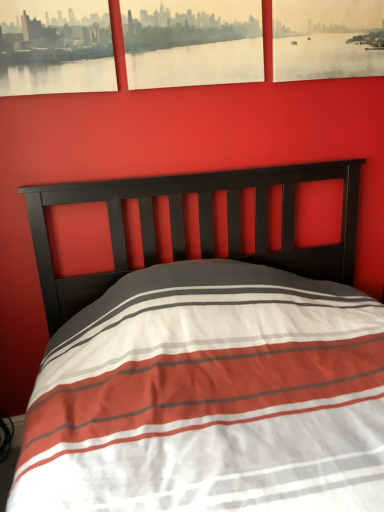
Find the location of a particular element. The image size is (384, 512). matte black picture frame at upper left, the third picture frame in the right-to-left sequence is located at coordinates (55, 47).

Is matte black picture frame at upper left, the third picture frame in the right-to-left sequence, oriented towards matte paper picture frame at upper right, which ranks as the first picture frame in right-to-left order?

No, matte black picture frame at upper left, the third picture frame in the right-to-left sequence, does not turn towards matte paper picture frame at upper right, which ranks as the first picture frame in right-to-left order.

From the image's perspective, is matte black picture frame at upper left, arranged as the first picture frame when viewed from the left, over matte paper picture frame at upper right, which is the 3th picture frame in left-to-right order?

No, from the image's perspective, matte black picture frame at upper left, arranged as the first picture frame when viewed from the left, is not above matte paper picture frame at upper right, which is the 3th picture frame in left-to-right order.

Does matte black picture frame at upper left, the third picture frame in the right-to-left sequence, have a greater width compared to matte paper picture frame at upper right, which is the 3th picture frame in left-to-right order?

Yes.

From a real-world perspective, is matte black picture frame at upper left, arranged as the first picture frame when viewed from the left, on matte paper picture frame at upper right, which is the 3th picture frame in left-to-right order?

Yes, from a real-world perspective, matte black picture frame at upper left, arranged as the first picture frame when viewed from the left, is over matte paper picture frame at upper right, which is the 3th picture frame in left-to-right order

How distant is matte black picture frame at upper left, arranged as the first picture frame when viewed from the left, from matte paper picture frame at upper center, acting as the second picture frame starting from the left?

matte black picture frame at upper left, arranged as the first picture frame when viewed from the left, and matte paper picture frame at upper center, acting as the second picture frame starting from the left, are 11.46 inches apart from each other.

Which is more to the left, matte black picture frame at upper left, arranged as the first picture frame when viewed from the left, or matte paper picture frame at upper center, acting as the second picture frame starting from the left?

matte black picture frame at upper left, arranged as the first picture frame when viewed from the left, is more to the left.

Image resolution: width=384 pixels, height=512 pixels. What are the coordinates of `picture frame that is below the matte paper picture frame at upper center, acting as the second picture frame starting from the right (from the image's perspective)` in the screenshot? It's located at (55, 47).

Is matte black picture frame at upper left, the third picture frame in the right-to-left sequence, directly adjacent to matte paper picture frame at upper center, acting as the second picture frame starting from the right?

There is a gap between matte black picture frame at upper left, the third picture frame in the right-to-left sequence, and matte paper picture frame at upper center, acting as the second picture frame starting from the right.

Does matte paper picture frame at upper center, acting as the second picture frame starting from the right, have a lesser height compared to matte paper picture frame at upper right, which is the 3th picture frame in left-to-right order?

Correct, matte paper picture frame at upper center, acting as the second picture frame starting from the right, is not as tall as matte paper picture frame at upper right, which is the 3th picture frame in left-to-right order.

Between matte paper picture frame at upper center, acting as the second picture frame starting from the left, and matte paper picture frame at upper right, which is the 3th picture frame in left-to-right order, which one is positioned in front?

matte paper picture frame at upper center, acting as the second picture frame starting from the left.

Which is more to the left, matte paper picture frame at upper center, acting as the second picture frame starting from the left, or matte paper picture frame at upper right, which ranks as the first picture frame in right-to-left order?

matte paper picture frame at upper center, acting as the second picture frame starting from the left, is more to the left.

From the image's perspective, does matte paper picture frame at upper center, acting as the second picture frame starting from the left, appear higher than matte paper picture frame at upper right, which ranks as the first picture frame in right-to-left order?

No, from the image's perspective, matte paper picture frame at upper center, acting as the second picture frame starting from the left, is not above matte paper picture frame at upper right, which ranks as the first picture frame in right-to-left order.

Which object is further away from the camera taking this photo, matte paper picture frame at upper right, which is the 3th picture frame in left-to-right order, or matte black picture frame at upper left, arranged as the first picture frame when viewed from the left?

matte paper picture frame at upper right, which is the 3th picture frame in left-to-right order.

Does matte paper picture frame at upper right, which ranks as the first picture frame in right-to-left order, have a lesser width compared to matte black picture frame at upper left, the third picture frame in the right-to-left sequence?

Yes, matte paper picture frame at upper right, which ranks as the first picture frame in right-to-left order, is thinner than matte black picture frame at upper left, the third picture frame in the right-to-left sequence.

How far apart are matte paper picture frame at upper right, which ranks as the first picture frame in right-to-left order, and matte black picture frame at upper left, the third picture frame in the right-to-left sequence?

A distance of 87.72 centimeters exists between matte paper picture frame at upper right, which ranks as the first picture frame in right-to-left order, and matte black picture frame at upper left, the third picture frame in the right-to-left sequence.

Considering the relative sizes of matte paper picture frame at upper right, which is the 3th picture frame in left-to-right order, and matte black picture frame at upper left, arranged as the first picture frame when viewed from the left, in the image provided, is matte paper picture frame at upper right, which is the 3th picture frame in left-to-right order, smaller than matte black picture frame at upper left, arranged as the first picture frame when viewed from the left,?

Incorrect, matte paper picture frame at upper right, which is the 3th picture frame in left-to-right order, is not smaller in size than matte black picture frame at upper left, arranged as the first picture frame when viewed from the left.

The width and height of the screenshot is (384, 512). In order to click on picture frame above the matte paper picture frame at upper center, acting as the second picture frame starting from the left (from a real-world perspective) in this screenshot , I will do `click(55, 47)`.

Does matte paper picture frame at upper center, acting as the second picture frame starting from the left, have a smaller size compared to matte black picture frame at upper left, arranged as the first picture frame when viewed from the left?

Incorrect, matte paper picture frame at upper center, acting as the second picture frame starting from the left, is not smaller in size than matte black picture frame at upper left, arranged as the first picture frame when viewed from the left.

Considering the positions of points (192, 67) and (58, 58), is point (192, 67) farther from camera compared to point (58, 58)?

That is True.

From a real-world perspective, is matte paper picture frame at upper center, acting as the second picture frame starting from the right, positioned above or below matte black picture frame at upper left, arranged as the first picture frame when viewed from the left?

matte paper picture frame at upper center, acting as the second picture frame starting from the right, is below matte black picture frame at upper left, arranged as the first picture frame when viewed from the left.

Can you confirm if matte paper picture frame at upper right, which is the 3th picture frame in left-to-right order, is thinner than matte paper picture frame at upper center, acting as the second picture frame starting from the right?

Yes.

From a real-world perspective, is matte paper picture frame at upper right, which is the 3th picture frame in left-to-right order, positioned above or below matte paper picture frame at upper center, acting as the second picture frame starting from the right?

matte paper picture frame at upper right, which is the 3th picture frame in left-to-right order, is below matte paper picture frame at upper center, acting as the second picture frame starting from the right.

Is the position of matte paper picture frame at upper right, which ranks as the first picture frame in right-to-left order, more distant than that of matte paper picture frame at upper center, acting as the second picture frame starting from the right?

Yes, matte paper picture frame at upper right, which ranks as the first picture frame in right-to-left order, is further from the camera.

Is matte paper picture frame at upper right, which ranks as the first picture frame in right-to-left order, situated inside matte paper picture frame at upper center, acting as the second picture frame starting from the right, or outside?

matte paper picture frame at upper right, which ranks as the first picture frame in right-to-left order, exists outside the volume of matte paper picture frame at upper center, acting as the second picture frame starting from the right.

From the image's perspective, starting from the matte paper picture frame at upper right, which is the 3th picture frame in left-to-right order, which picture frame is the 2nd one below? Please provide its 2D coordinates.

[(55, 47)]

From the matte black picture frame at upper left, arranged as the first picture frame when viewed from the left, count 1st picture frames backward and point to it. Please provide its 2D coordinates.

[(192, 42)]

Which object lies nearer to the anchor point matte black picture frame at upper left, the third picture frame in the right-to-left sequence, matte paper picture frame at upper right, which ranks as the first picture frame in right-to-left order, or matte paper picture frame at upper center, acting as the second picture frame starting from the left?

Based on the image, matte paper picture frame at upper center, acting as the second picture frame starting from the left, appears to be nearer to matte black picture frame at upper left, the third picture frame in the right-to-left sequence.

Estimate the real-world distances between objects in this image. Which object is closer to matte paper picture frame at upper right, which ranks as the first picture frame in right-to-left order, matte black picture frame at upper left, the third picture frame in the right-to-left sequence, or matte paper picture frame at upper center, acting as the second picture frame starting from the left?

matte paper picture frame at upper center, acting as the second picture frame starting from the left, is positioned closer to the anchor matte paper picture frame at upper right, which ranks as the first picture frame in right-to-left order.

Which object lies further to the anchor point matte paper picture frame at upper center, acting as the second picture frame starting from the left, matte paper picture frame at upper right, which is the 3th picture frame in left-to-right order, or matte black picture frame at upper left, the third picture frame in the right-to-left sequence?

matte paper picture frame at upper right, which is the 3th picture frame in left-to-right order, is further to matte paper picture frame at upper center, acting as the second picture frame starting from the left.

Considering their positions, is matte paper picture frame at upper center, acting as the second picture frame starting from the right, positioned closer to matte paper picture frame at upper right, which ranks as the first picture frame in right-to-left order, than matte black picture frame at upper left, arranged as the first picture frame when viewed from the left?

Among the two, matte paper picture frame at upper center, acting as the second picture frame starting from the right, is located nearer to matte paper picture frame at upper right, which ranks as the first picture frame in right-to-left order.

Looking at the image, which one is located further to matte black picture frame at upper left, the third picture frame in the right-to-left sequence, matte paper picture frame at upper center, acting as the second picture frame starting from the left, or matte paper picture frame at upper right, which ranks as the first picture frame in right-to-left order?

matte paper picture frame at upper right, which ranks as the first picture frame in right-to-left order, lies further to matte black picture frame at upper left, the third picture frame in the right-to-left sequence, than the other object.

From the image, which object appears to be farther from matte paper picture frame at upper center, acting as the second picture frame starting from the left, matte black picture frame at upper left, arranged as the first picture frame when viewed from the left, or matte paper picture frame at upper right, which ranks as the first picture frame in right-to-left order?

matte paper picture frame at upper right, which ranks as the first picture frame in right-to-left order, lies further to matte paper picture frame at upper center, acting as the second picture frame starting from the left, than the other object.

Identify the location of picture frame between matte black picture frame at upper left, arranged as the first picture frame when viewed from the left, and matte paper picture frame at upper right, which ranks as the first picture frame in right-to-left order, from left to right. The height and width of the screenshot is (512, 384). (192, 42).